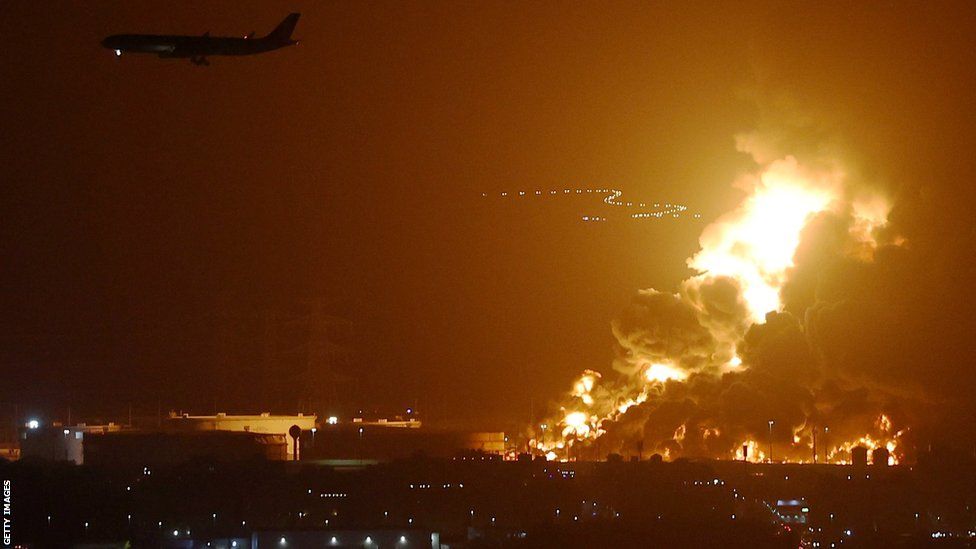
What are the coordinates of `bright light` in the screenshot? It's located at pos(790,211), pos(758,273), pos(587,425), pos(582,386), pos(653,375), pos(608,405), pos(733,355), pos(750,450), pos(885,444).